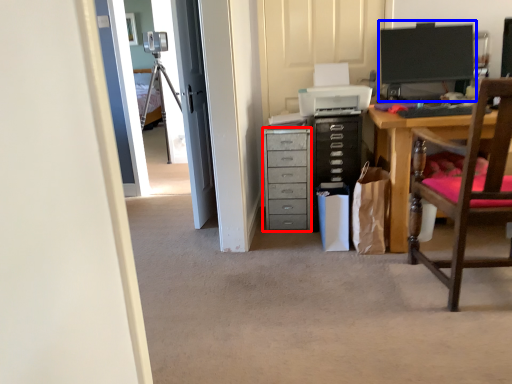
Question: Which of the following is the farthest to the observer, chest of drawers (highlighted by a red box) or computer monitor (highlighted by a blue box)?

Choices:
 (A) chest of drawers
 (B) computer monitor

Answer: (A)